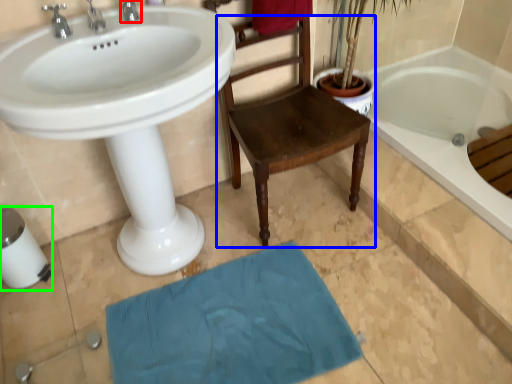
Question: Which is farther away from tap (highlighted by a red box)? chair (highlighted by a blue box) or toilet paper (highlighted by a green box)?

Choices:
 (A) chair
 (B) toilet paper

Answer: (B)